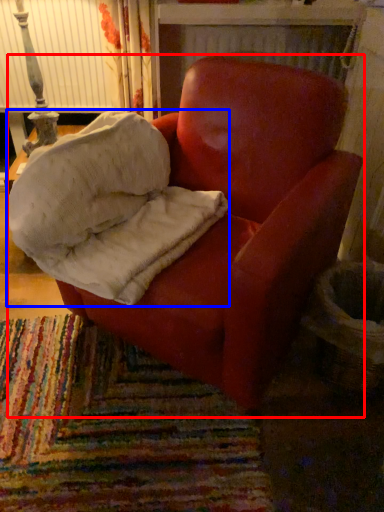
Question: Among these objects, which one is nearest to the camera, chair (highlighted by a red box) or material (highlighted by a blue box)?

Choices:
 (A) chair
 (B) material

Answer: (A)